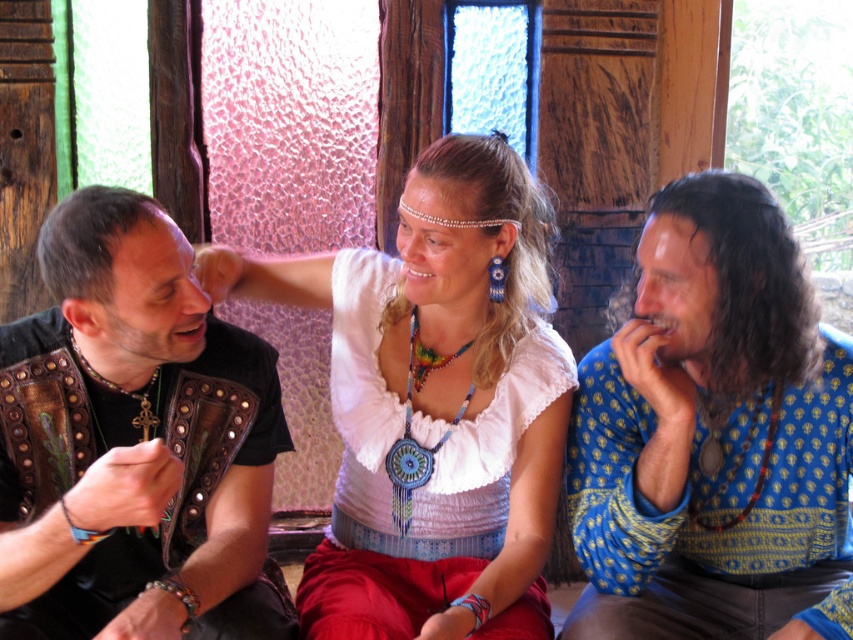
What is located at the coordinates point (434, 404)?

The white fabric blouse at center is located at point (434, 404).

Looking at the scene, which object is positioned higher between the white fabric blouse at center and the rainbow beaded necklace at center?

The rainbow beaded necklace at center is positioned higher than the white fabric blouse at center.